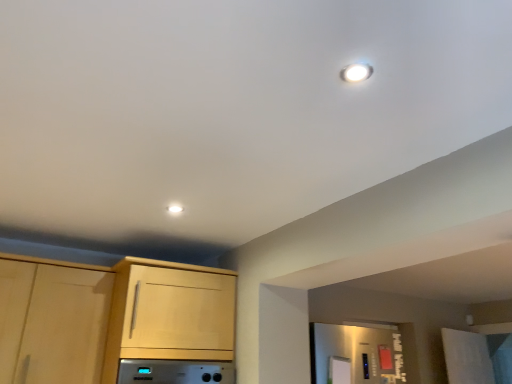
Identify the location of white glossy light fixture at upper center. (175, 209).

What do you see at coordinates (175, 209) in the screenshot? I see `white glossy light fixture at upper center` at bounding box center [175, 209].

What are the coordinates of `white glossy light fixture at upper center` in the screenshot? It's located at (175, 209).